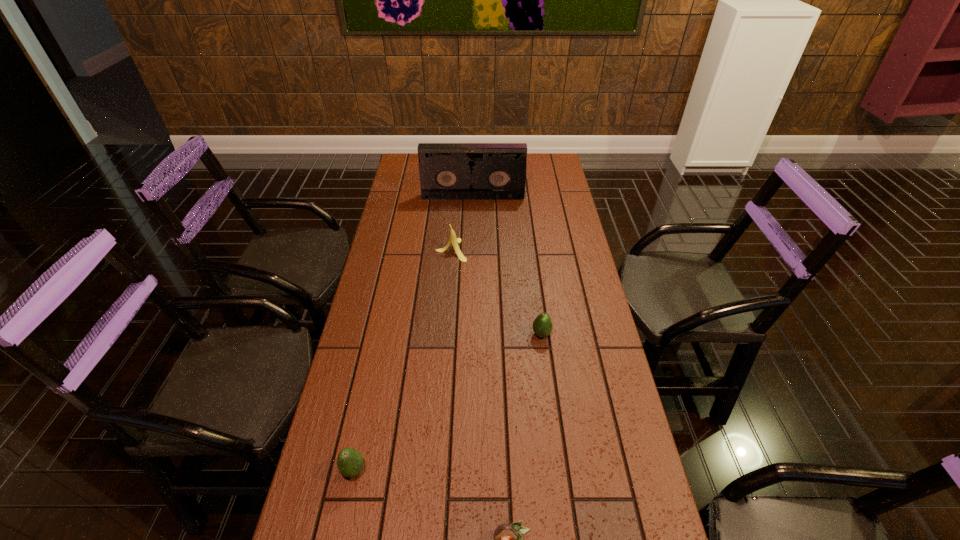
Image resolution: width=960 pixels, height=540 pixels. I want to click on unoccupied area between the farthest avocado and the second farthest object, so click(x=496, y=292).

This screenshot has height=540, width=960. What are the coordinates of `vacant area between the farthest object and the fourth farthest object` in the screenshot? It's located at (414, 334).

The image size is (960, 540). Identify the location of blank region between the banana and the farthest object. (462, 224).

Identify which object is the second nearest to the second nearest object. Please provide its 2D coordinates. Your answer should be formatted as a tuple, i.e. [(x, y)], where the tuple contains the x and y coordinates of a point satisfying the conditions above.

[(542, 326)]

I want to click on object that stands as the closest to the second nearest object, so click(x=508, y=539).

Locate an element on the screen. Image resolution: width=960 pixels, height=540 pixels. the closest avocado to the second avocado from right to left is located at coordinates (350, 462).

Point out which avocado is positioned as the nearest to the rightmost avocado. Please provide its 2D coordinates. Your answer should be formatted as a tuple, i.e. [(x, y)], where the tuple contains the x and y coordinates of a point satisfying the conditions above.

[(508, 539)]